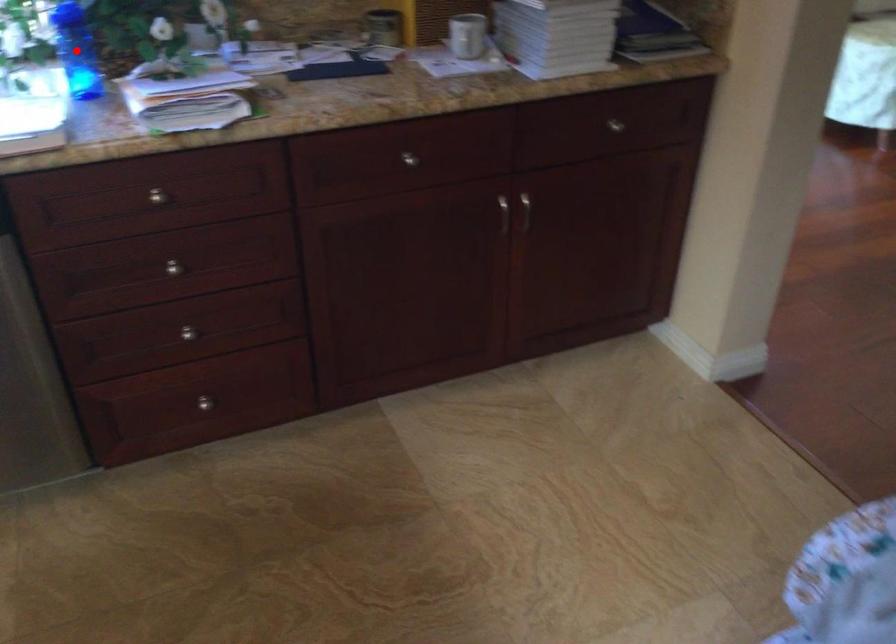
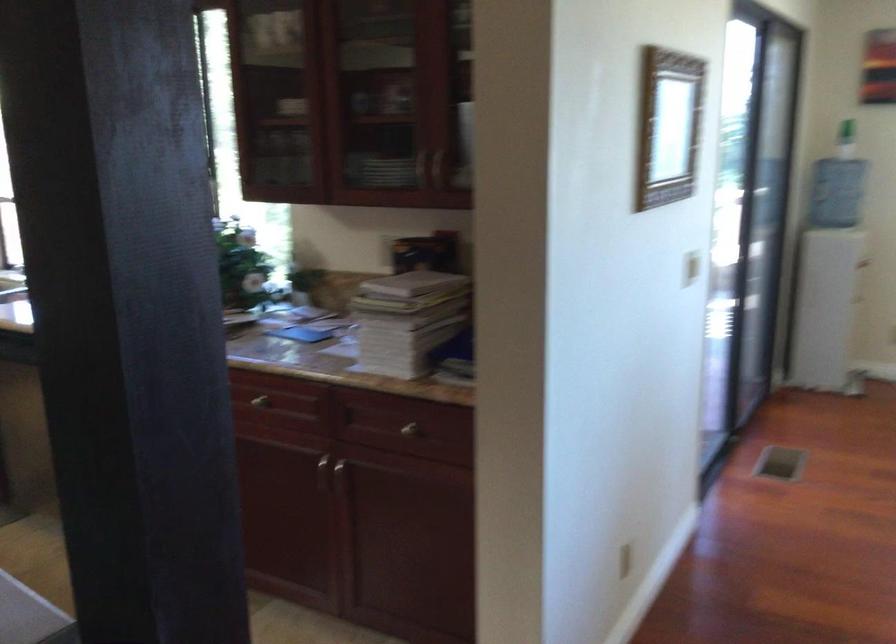
Question: I am providing you with two images of the same scene from different viewpoints. A red point is marked on the first image. Can you still see the location of the red point in image 2?

Choices:
 (A) Yes
 (B) No

Answer: (B)